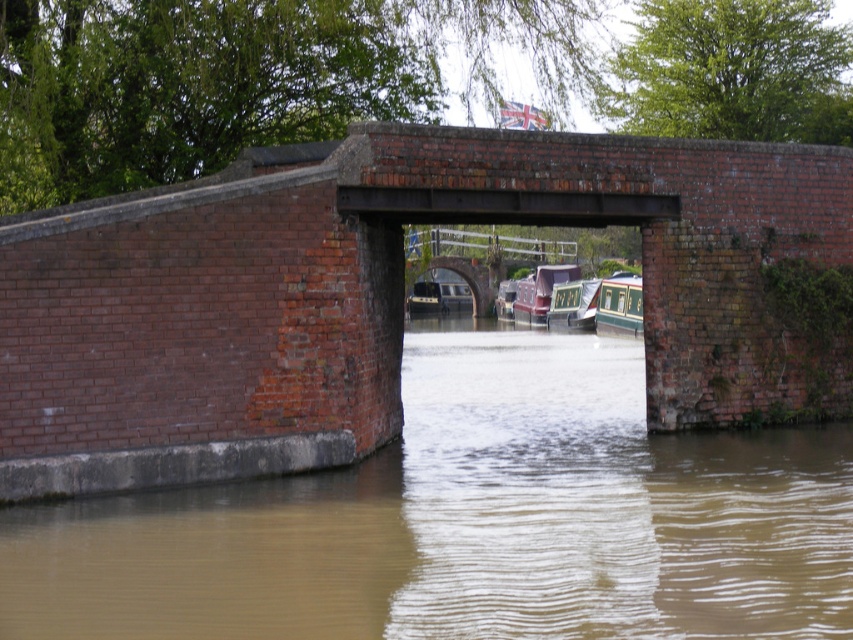
Between brick wall at center and green glossy canal boat at center, which one appears on the left side from the viewer's perspective?

brick wall at center is more to the left.

Who is more forward, (265, 243) or (579, 292)?

Point (265, 243) is in front.

This screenshot has height=640, width=853. Find the location of `brick wall at center`. brick wall at center is located at coordinates (364, 292).

Which of these two, brick wall at center or brown muddy water at center, stands taller?

Standing taller between the two is brick wall at center.

Between brick wall at center and brown muddy water at center, which one appears on the left side from the viewer's perspective?

From the viewer's perspective, brick wall at center appears more on the left side.

Which is in front, point (306, 456) or point (621, 634)?

Point (621, 634) is more forward.

Locate an element on the screen. brick wall at center is located at coordinates (364, 292).

Can you confirm if green glossy boat at center is positioned to the right of maroon glossy boat at center?

Correct, you'll find green glossy boat at center to the right of maroon glossy boat at center.

Who is positioned more to the left, green glossy boat at center or maroon glossy boat at center?

Positioned to the left is maroon glossy boat at center.

Is point (625, 301) farther from camera compared to point (538, 305)?

That is False.

The height and width of the screenshot is (640, 853). Identify the location of green glossy boat at center. (619, 305).